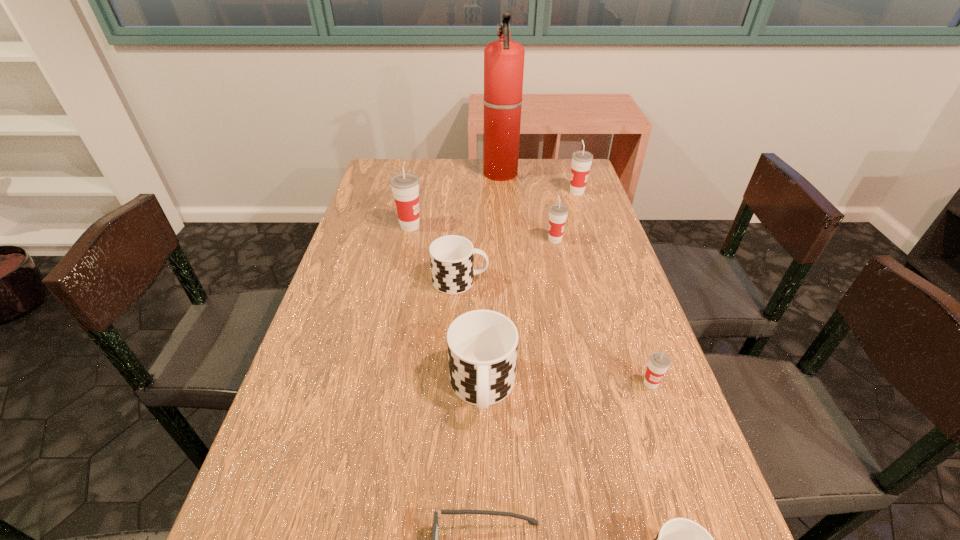
The image size is (960, 540). What are the coordinates of `red fire extinguisher` in the screenshot? It's located at (x=503, y=59).

Image resolution: width=960 pixels, height=540 pixels. I want to click on fire extinguisher, so click(503, 59).

In order to click on the tallest cup in this screenshot , I will do `click(405, 186)`.

Locate an element on the screen. the leftmost cup is located at coordinates (405, 186).

Find the location of a particular element. Image resolution: width=960 pixels, height=540 pixels. the second tallest cup is located at coordinates (581, 160).

The height and width of the screenshot is (540, 960). I want to click on the third tallest object, so click(581, 160).

This screenshot has height=540, width=960. In order to click on the third farthest cup in this screenshot , I will do `click(558, 212)`.

At what (x,y) coordinates should I click in order to perform the action: click on the fourth farthest object. Please return your answer as a coordinate pair (x, y). Image resolution: width=960 pixels, height=540 pixels. Looking at the image, I should click on (558, 212).

This screenshot has width=960, height=540. Identify the location of the second nearest black cup. point(482,345).

What are the coordinates of `the nearest red cup` in the screenshot? It's located at (659, 362).